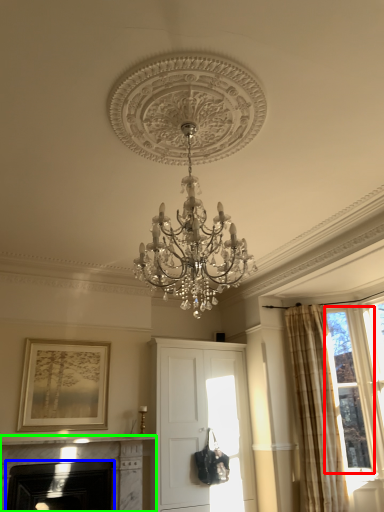
Question: Estimate the real-world distances between objects in this image. Which object is farther from bay window (highlighted by a red box), fireplace (highlighted by a blue box) or fireplace (highlighted by a green box)?

Choices:
 (A) fireplace
 (B) fireplace

Answer: (A)